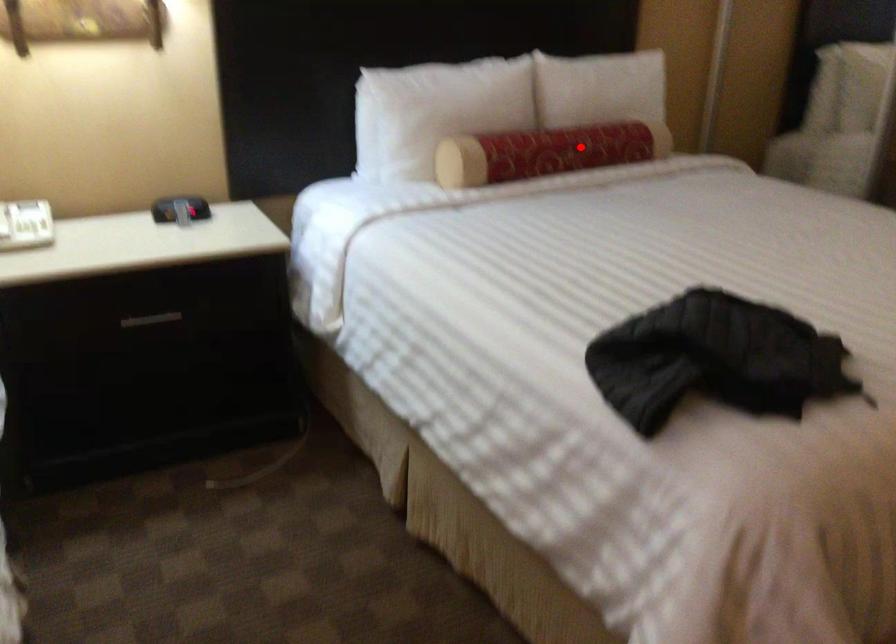
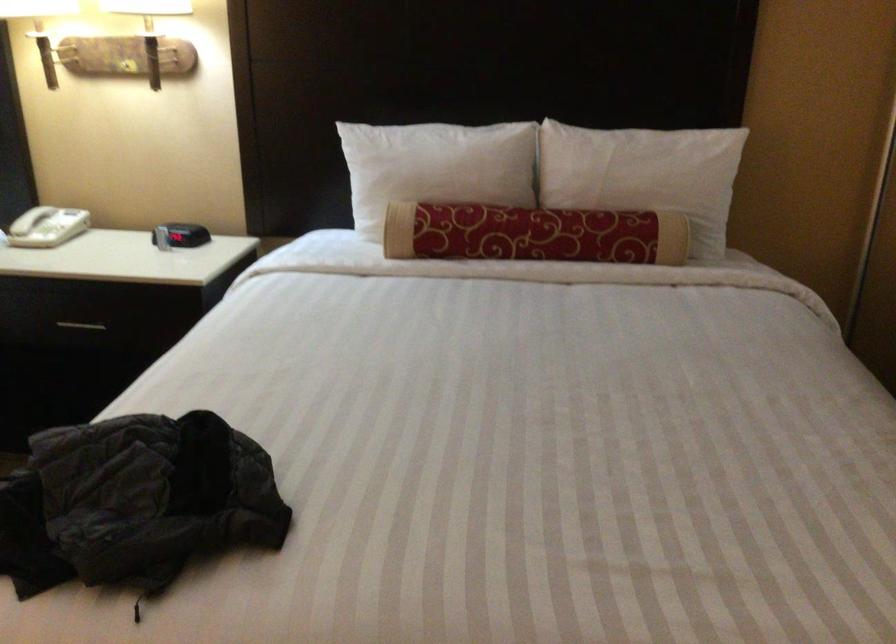
Locate, in the second image, the point that corresponds to the highlighted location in the first image.

(533, 234)